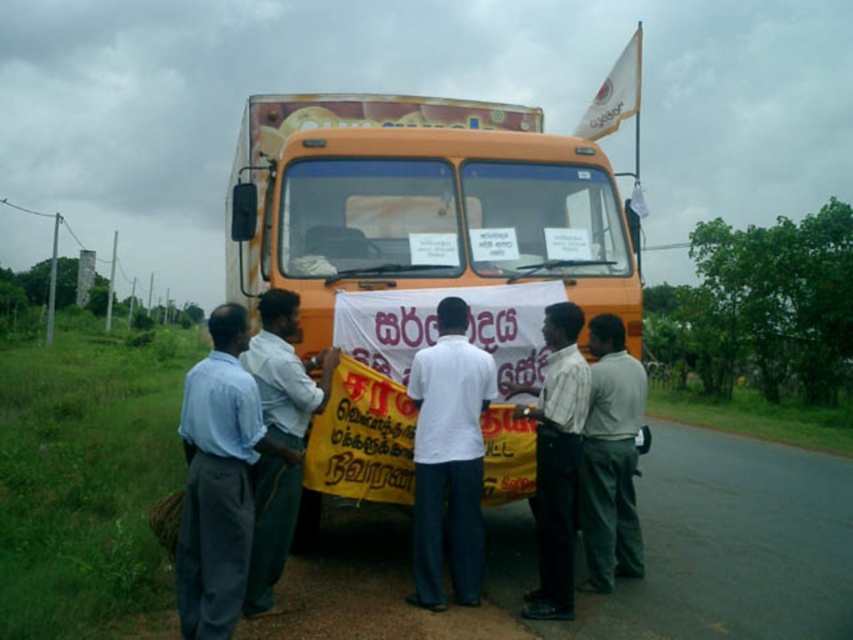
Consider the image. Is dark gray pants at right positioned in front of white shirt at center?

No, dark gray pants at right is behind white shirt at center.

Does point (602, 320) lie in front of point (546, 618)?

That is False.

At what (x,y) coordinates should I click in order to perform the action: click on dark gray pants at right. Please return your answer as a coordinate pair (x, y). The image size is (853, 640). Looking at the image, I should click on (610, 458).

Is light blue shirt at left wider than white matte shirt at center?

Correct, the width of light blue shirt at left exceeds that of white matte shirt at center.

Is point (253, 460) farther from camera compared to point (492, 388)?

No, (253, 460) is in front of (492, 388).

This screenshot has width=853, height=640. In order to click on light blue shirt at left in this screenshot , I will do `click(219, 480)`.

Locate an element on the screen. light blue shirt at left is located at coordinates (219, 480).

Between orange matte truck at center and light blue shirt at left, which one appears on the left side from the viewer's perspective?

Positioned to the left is orange matte truck at center.

Is point (309, 536) closer to camera compared to point (231, 380)?

That is False.

Locate an element on the screen. This screenshot has width=853, height=640. orange matte truck at center is located at coordinates (421, 204).